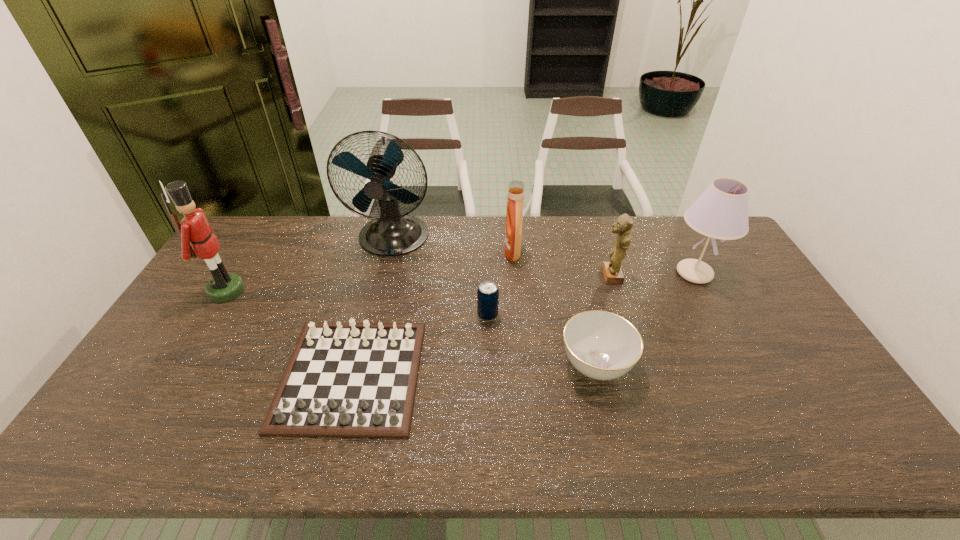
This screenshot has height=540, width=960. Identify the location of vacant area at the near edge of the desktop. (185, 448).

You are a GUI agent. You are given a task and a screenshot of the screen. Output one action in this format:
    pyautogui.click(x=<x>, y=<y>)
    Task: Click on the vacant position at the left edge of the desktop
    
    Given the screenshot: What is the action you would take?
    pyautogui.click(x=212, y=319)

Where is `vacant position at the right edge of the desktop`? vacant position at the right edge of the desktop is located at coordinates (741, 332).

Identify the location of empty space between the fan and the shortest object. The image size is (960, 540). (372, 307).

Image resolution: width=960 pixels, height=540 pixels. Find the location of `free space between the third tallest object and the shortest object`. free space between the third tallest object and the shortest object is located at coordinates (523, 324).

Where is `vacant space in between the chinaware and the fourth object from right to left`? The height and width of the screenshot is (540, 960). vacant space in between the chinaware and the fourth object from right to left is located at coordinates (554, 308).

The width and height of the screenshot is (960, 540). Identify the location of vacant area between the chinaware and the lampshade. (645, 319).

Where is `free space that is in between the soda can and the detergent`? Image resolution: width=960 pixels, height=540 pixels. free space that is in between the soda can and the detergent is located at coordinates (500, 284).

Where is `empty location between the figurine and the fan`? empty location between the figurine and the fan is located at coordinates (502, 257).

Locate an element on the screen. vacant space in between the third nearest object and the chinaware is located at coordinates coord(541,340).